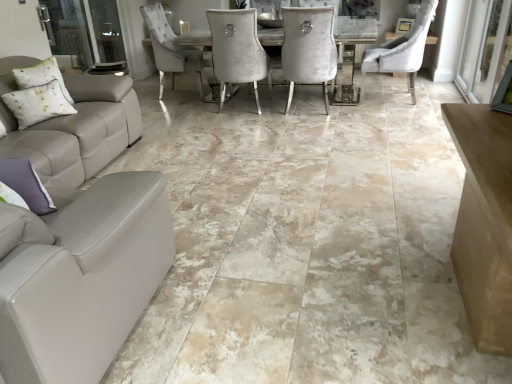
Question: Would you say purple fabric pillow at lower left, acting as the second pillow starting from the back, is outside clear glass screen door at left, acting as the 1th screen door starting from the left?

Choices:
 (A) yes
 (B) no

Answer: (A)

Question: Is purple fabric pillow at lower left, positioned as the first pillow in bottom-to-top order, oriented towards clear glass screen door at left, which appears as the second screen door when viewed from the right?

Choices:
 (A) yes
 (B) no

Answer: (B)

Question: Is the position of purple fabric pillow at lower left, marked as the 1th pillow in a front-to-back arrangement, less distant than that of clear glass screen door at left, which appears as the second screen door when viewed from the right?

Choices:
 (A) no
 (B) yes

Answer: (B)

Question: Does purple fabric pillow at lower left, positioned as the first pillow in right-to-left order, have a lesser height compared to clear glass screen door at left, which appears as the second screen door when viewed from the right?

Choices:
 (A) yes
 (B) no

Answer: (A)

Question: From a real-world perspective, is purple fabric pillow at lower left, acting as the second pillow starting from the back, located beneath clear glass screen door at left, acting as the 1th screen door starting from the left?

Choices:
 (A) no
 (B) yes

Answer: (A)

Question: Considering the positions of transparent glass screen door at right, placed as the 1th screen door when sorted from right to left, and purple fabric pillow at lower left, acting as the second pillow starting from the back, in the image, is transparent glass screen door at right, placed as the 1th screen door when sorted from right to left, wider or thinner than purple fabric pillow at lower left, acting as the second pillow starting from the back,?

Choices:
 (A) wide
 (B) thin

Answer: (B)

Question: Would you say transparent glass screen door at right, placed as the 1th screen door when sorted from right to left, is inside or outside purple fabric pillow at lower left, marked as the 1th pillow in a front-to-back arrangement?

Choices:
 (A) outside
 (B) inside

Answer: (A)

Question: From a real-world perspective, relative to purple fabric pillow at lower left, which is counted as the second pillow, starting from the top, is transparent glass screen door at right, acting as the 2th screen door starting from the left, vertically above or below?

Choices:
 (A) above
 (B) below

Answer: (B)

Question: In the image, is transparent glass screen door at right, acting as the 2th screen door starting from the left, positioned in front of or behind purple fabric pillow at lower left, acting as the second pillow starting from the back?

Choices:
 (A) front
 (B) behind

Answer: (B)

Question: In terms of size, does transparent glass screen door at right, acting as the 2th screen door starting from the left, appear bigger or smaller than clear glass screen door at left, which appears as the second screen door when viewed from the right?

Choices:
 (A) big
 (B) small

Answer: (A)

Question: From their relative heights in the image, would you say transparent glass screen door at right, acting as the 2th screen door starting from the left, is taller or shorter than clear glass screen door at left, acting as the 1th screen door starting from the left?

Choices:
 (A) short
 (B) tall

Answer: (A)

Question: From the image's perspective, is transparent glass screen door at right, acting as the 2th screen door starting from the left, located above or below clear glass screen door at left, which appears as the second screen door when viewed from the right?

Choices:
 (A) above
 (B) below

Answer: (B)

Question: In the image, is transparent glass screen door at right, acting as the 2th screen door starting from the left, positioned in front of or behind clear glass screen door at left, acting as the 1th screen door starting from the left?

Choices:
 (A) behind
 (B) front

Answer: (B)

Question: Considering the relative positions of white textured pillow at left, marked as the first pillow in a back-to-front arrangement, and transparent glass screen door at right, placed as the 1th screen door when sorted from right to left, in the image provided, is white textured pillow at left, marked as the first pillow in a back-to-front arrangement, to the left or to the right of transparent glass screen door at right, placed as the 1th screen door when sorted from right to left,?

Choices:
 (A) left
 (B) right

Answer: (A)

Question: Is white textured pillow at left, marked as the first pillow in a back-to-front arrangement, spatially inside transparent glass screen door at right, acting as the 2th screen door starting from the left, or outside of it?

Choices:
 (A) outside
 (B) inside

Answer: (A)